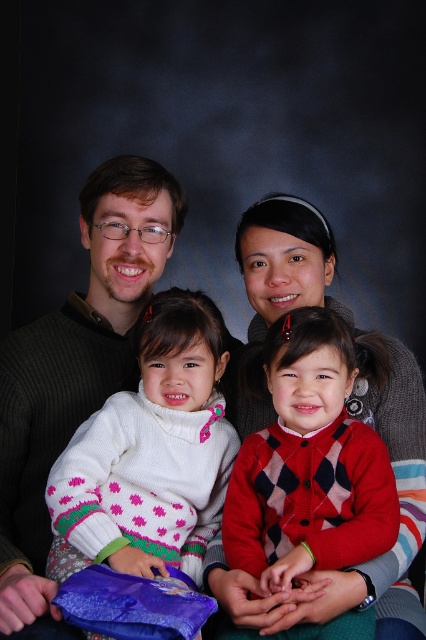
You are an assistant organizing a clothing donation drive. You need to place the dark gray sweater at left and the red argyle sweater at center into boxes. According to the image, which sweater is positioned higher up?

The dark gray sweater at left is located above the red argyle sweater at center, so it is positioned higher up.

You are trying to decide which sweater to wear for a casual day out. Both the white knitted sweater at center and the dark gray sweater at left are options. Based on their sizes, which one would be more suitable for layering under a coat?

The dark gray sweater at left is larger, making it more suitable for layering under a coat since it can accommodate the thickness of the coat better than the smaller white knitted sweater at center.